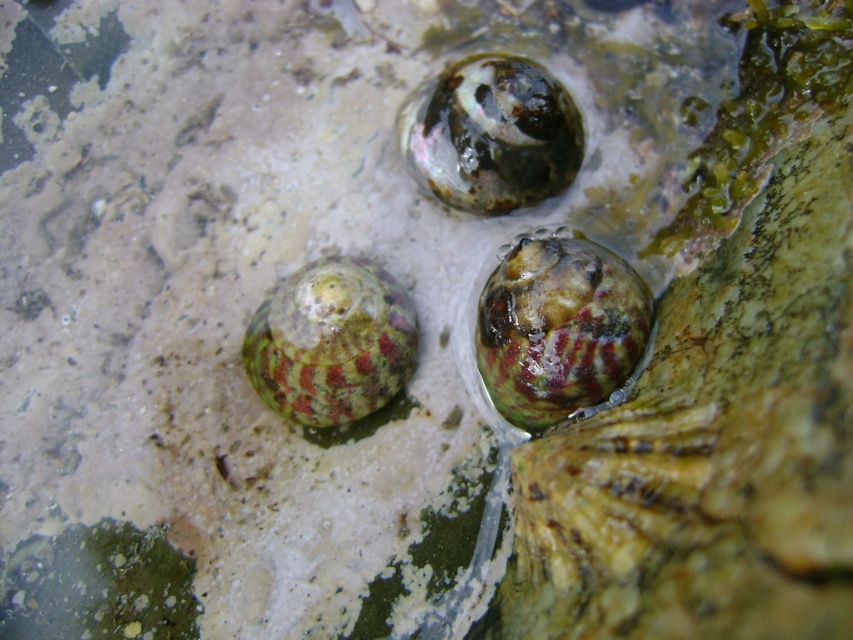
Who is higher up, green mottled shell at center or green marbled shell at center?

Positioned higher is green mottled shell at center.

Can you confirm if green mottled shell at center is taller than green marbled shell at center?

Indeed, green mottled shell at center has a greater height compared to green marbled shell at center.

This screenshot has width=853, height=640. Identify the location of green mottled shell at center. (558, 328).

This screenshot has height=640, width=853. I want to click on green mottled shell at center, so click(558, 328).

Does speckled stone shell at upper center lie in front of green marbled shell at center?

That is False.

Locate an element on the screen. This screenshot has height=640, width=853. speckled stone shell at upper center is located at coordinates (492, 134).

Which is in front, point (526, 168) or point (308, 422)?

Point (308, 422) is in front.

Find the location of `speckled stone shell at upper center`. speckled stone shell at upper center is located at coordinates (492, 134).

From the picture: Is green mottled shell at center positioned behind speckled stone shell at upper center?

No, green mottled shell at center is closer to the viewer.

Is green mottled shell at center thinner than speckled stone shell at upper center?

Correct, green mottled shell at center's width is less than speckled stone shell at upper center's.

Where is `green mottled shell at center`? Image resolution: width=853 pixels, height=640 pixels. green mottled shell at center is located at coordinates (558, 328).